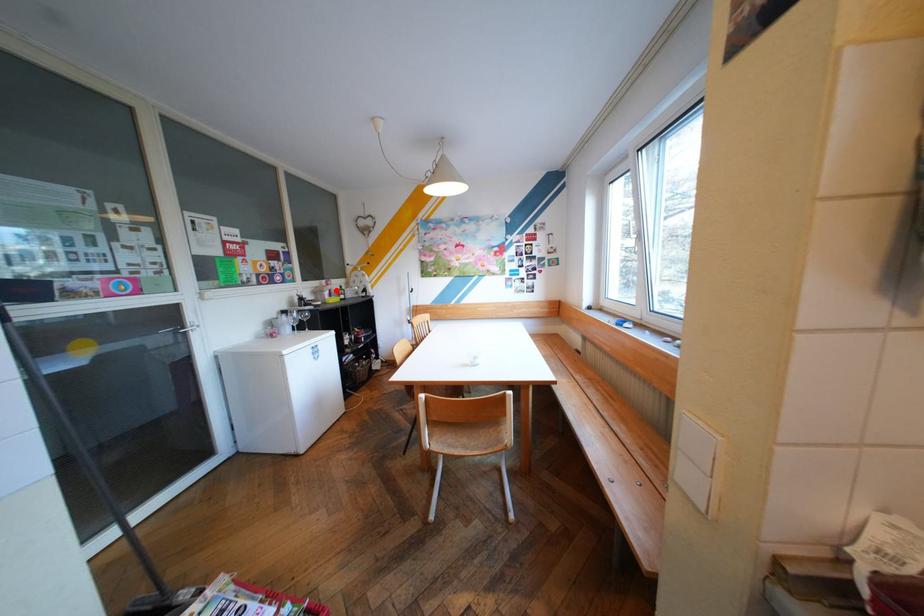
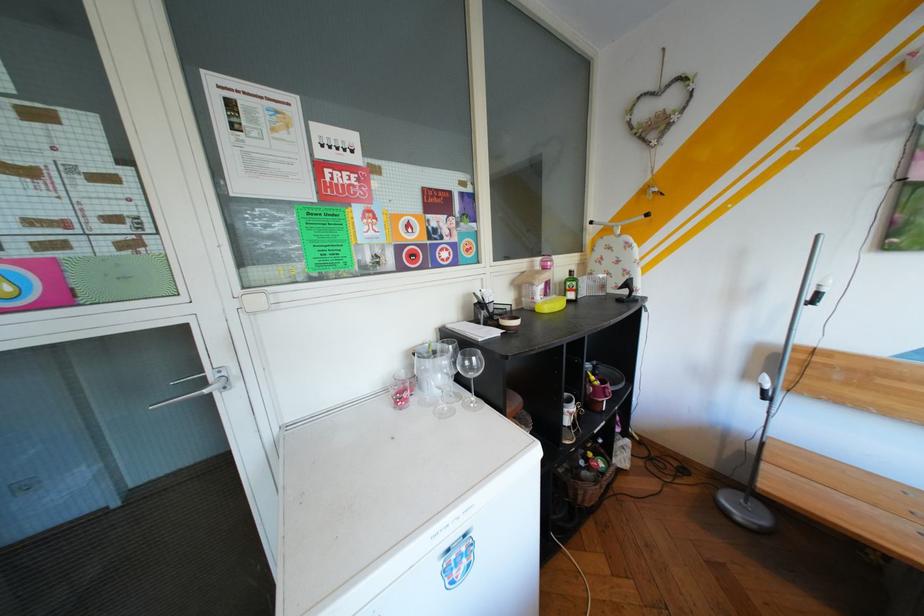
Find the pixel in the second image that matches the highlighted location in the first image.

(545, 284)